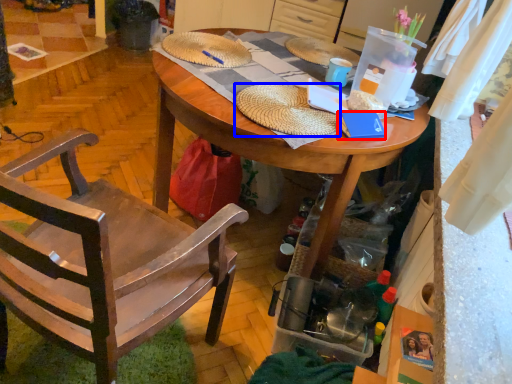
Question: Which point is further to the camera, book (highlighted by a red box) or hat (highlighted by a blue box)?

Choices:
 (A) book
 (B) hat

Answer: (A)